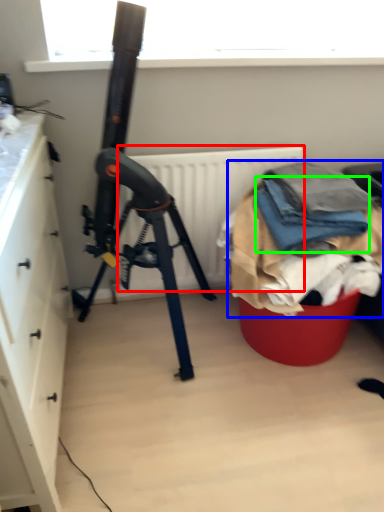
Question: Considering the real-world distances, which object is closest to radiator (highlighted by a red box)? waste (highlighted by a blue box) or clothing (highlighted by a green box).

Choices:
 (A) waste
 (B) clothing

Answer: (A)